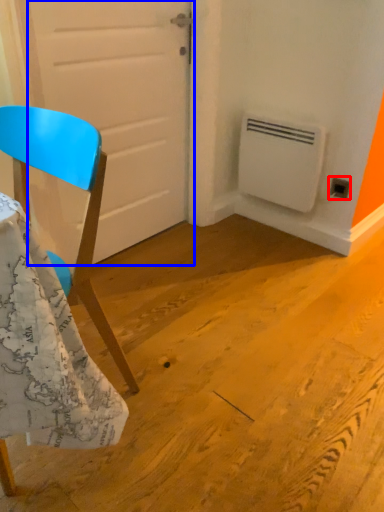
Question: Which object appears farthest to the camera in this image, electric outlet (highlighted by a red box) or door (highlighted by a blue box)?

Choices:
 (A) electric outlet
 (B) door

Answer: (A)